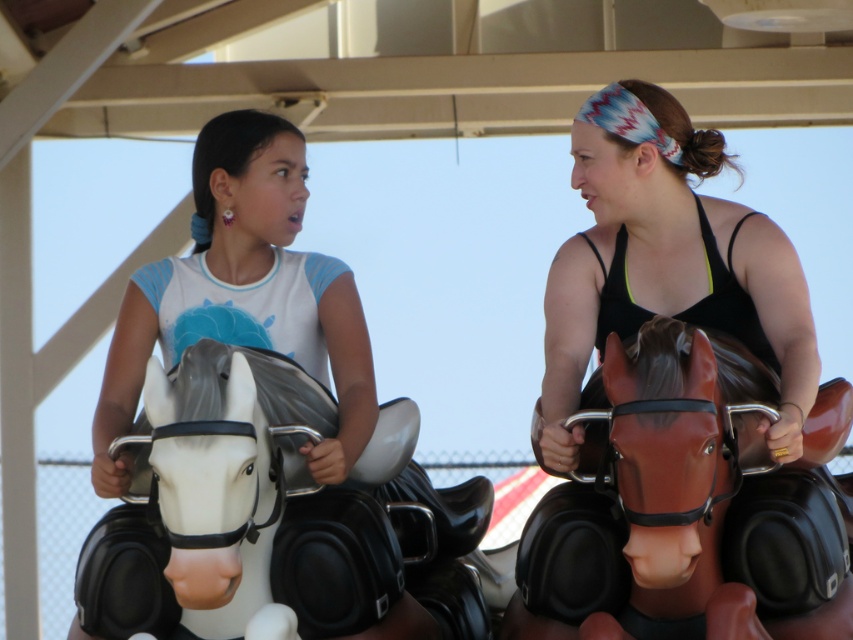
Question: Estimate the real-world distances between objects in this image. Which object is farther from the white glossy horse at left?

Choices:
 (A) shiny brown horse at right
 (B) matte black tank top at right

Answer: (A)

Question: Does shiny brown horse at right appear on the left side of white matte horse at left?

Choices:
 (A) no
 (B) yes

Answer: (A)

Question: Does shiny brown horse at right appear under white matte horse at left?

Choices:
 (A) no
 (B) yes

Answer: (B)

Question: Does white matte horse at left have a larger size compared to matte black tank top at right?

Choices:
 (A) no
 (B) yes

Answer: (A)

Question: Which point appears closest to the camera in this image?

Choices:
 (A) (573, 344)
 (B) (192, 326)
 (C) (741, 488)
 (D) (328, 616)

Answer: (D)

Question: Based on their relative distances, which object is nearer to the matte black tank top at right?

Choices:
 (A) white glossy horse at left
 (B) shiny brown horse at right

Answer: (B)